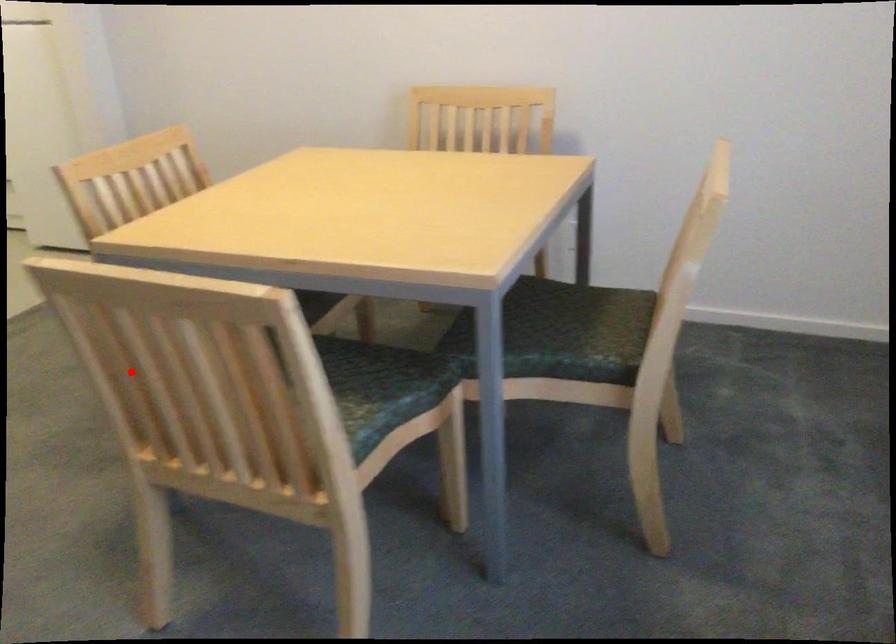
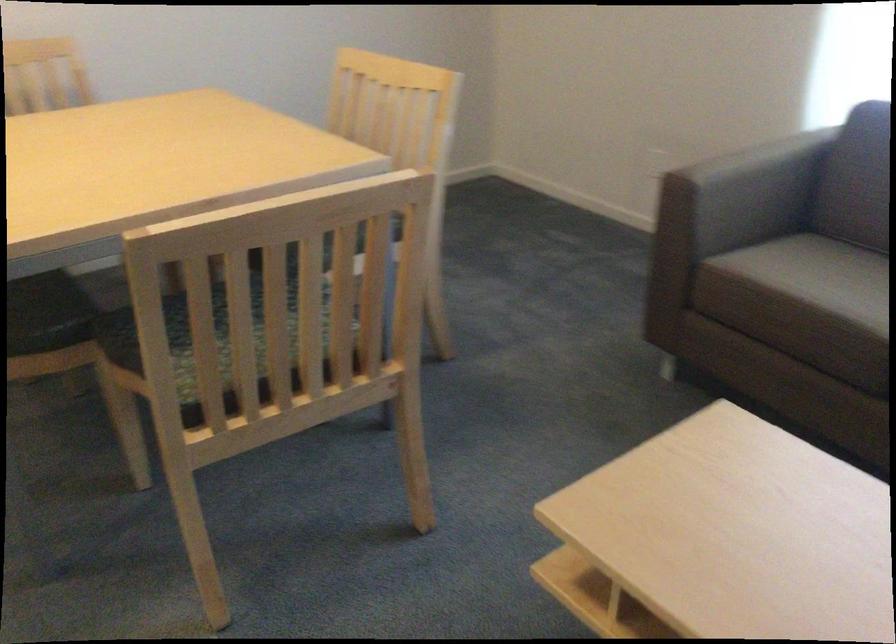
In the second image, find the point that corresponds to the highlighted location in the first image.

(211, 334)